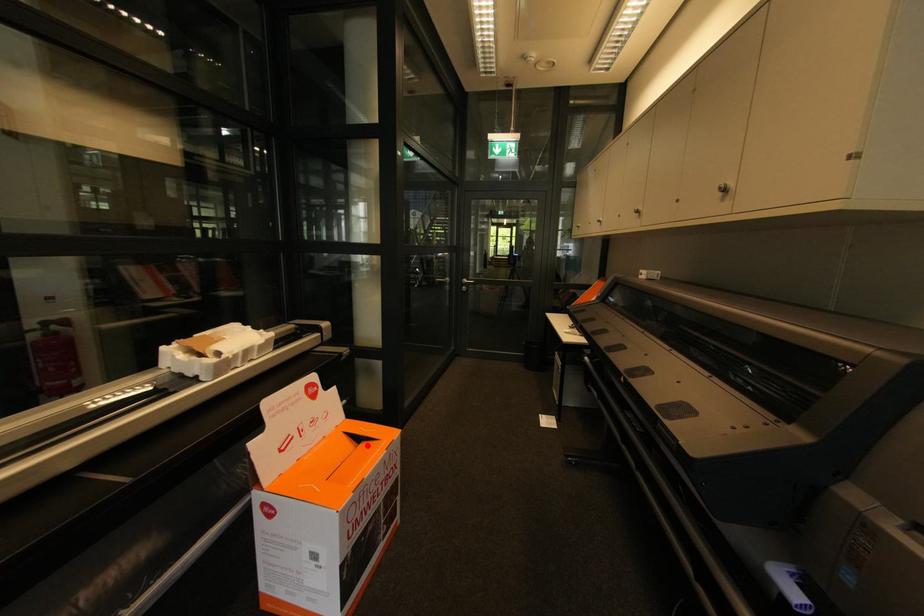
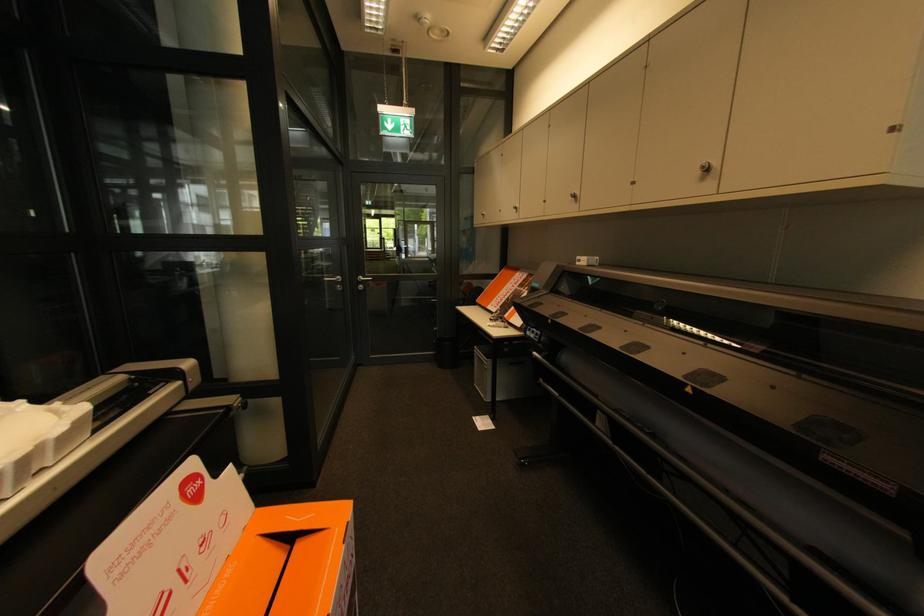
The point at the highlighted location is marked in the first image. Where is the corresponding point in the second image?

(304, 546)